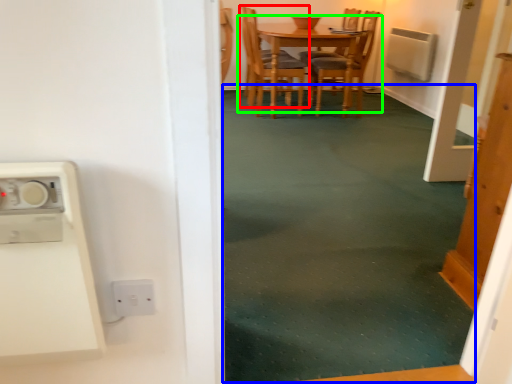
Question: Estimate the real-world distances between objects in this image. Which object is farther from chair (highlighted by a red box), plain (highlighted by a blue box) or kitchen & dining room table (highlighted by a green box)?

Choices:
 (A) plain
 (B) kitchen & dining room table

Answer: (A)